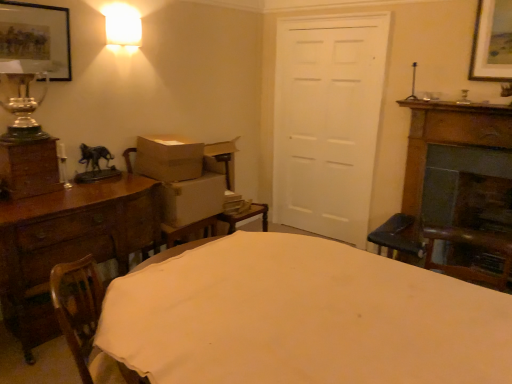
Where is `blank space situated above matte glass lampshade at upper left (from a real-world perspective)`? blank space situated above matte glass lampshade at upper left (from a real-world perspective) is located at coordinates (123, 17).